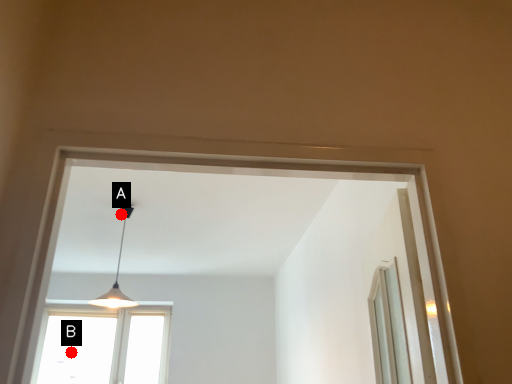
Question: Two points are circled on the image, labeled by A and B beside each circle. Which point is closer to the camera?

Choices:
 (A) A is closer
 (B) B is closer

Answer: (A)